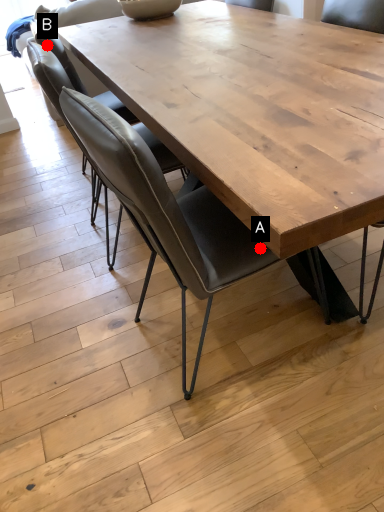
Question: Two points are circled on the image, labeled by A and B beside each circle. Which point appears closest to the camera in this image?

Choices:
 (A) A is closer
 (B) B is closer

Answer: (A)